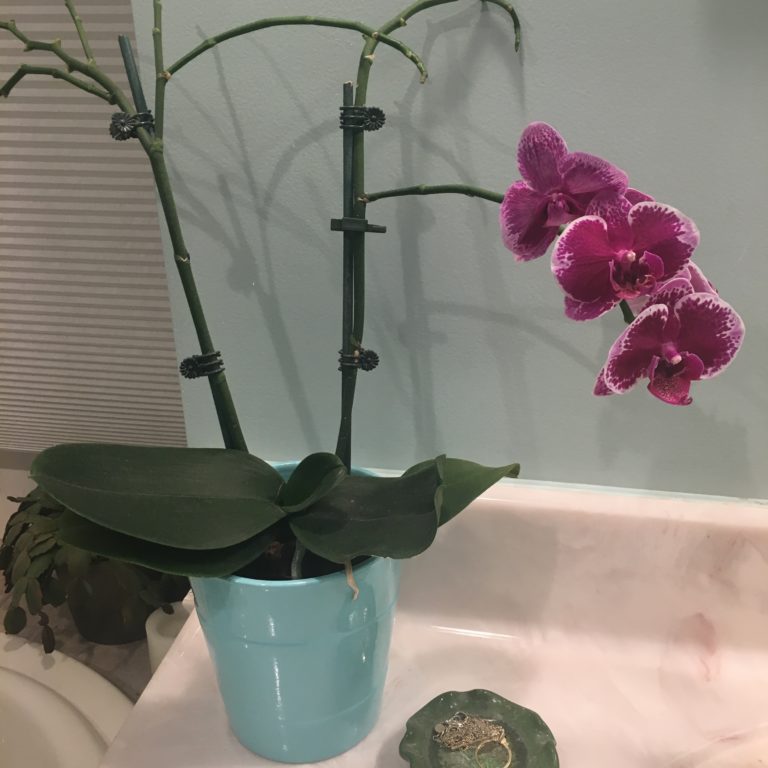
Identify the location of pot. The width and height of the screenshot is (768, 768). (104, 621), (288, 656).